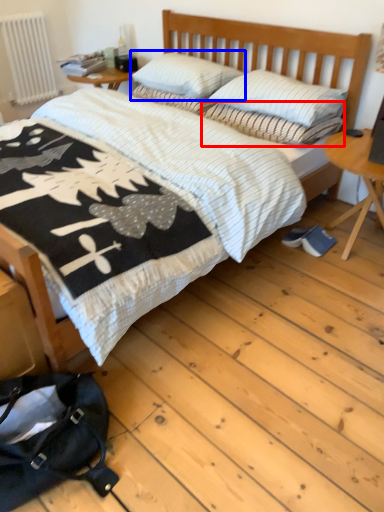
Question: Which object is closer to the camera taking this photo, pillow (highlighted by a red box) or pillow (highlighted by a blue box)?

Choices:
 (A) pillow
 (B) pillow

Answer: (A)